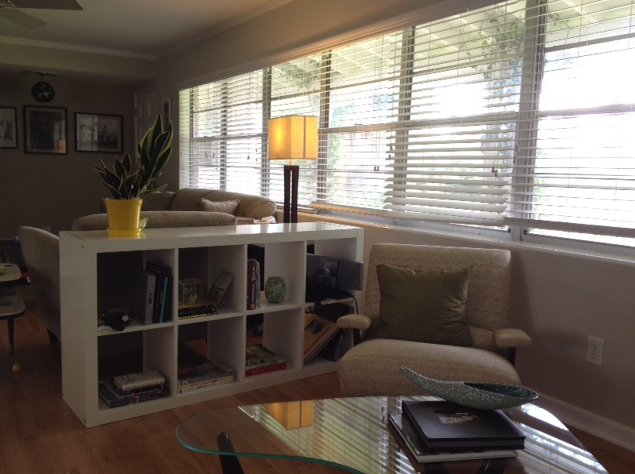
At what (x,y) coordinates should I click in order to perform the action: click on pillow. Please return your answer as a coordinate pair (x, y). The width and height of the screenshot is (635, 474). Looking at the image, I should click on (402, 295).